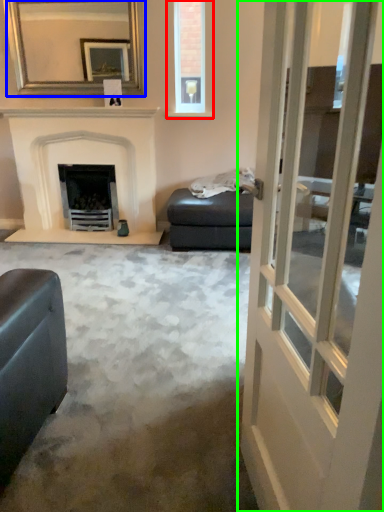
Question: Which is nearer to the window (highlighted by a red box)? mirror (highlighted by a blue box) or door (highlighted by a green box).

Choices:
 (A) mirror
 (B) door

Answer: (A)